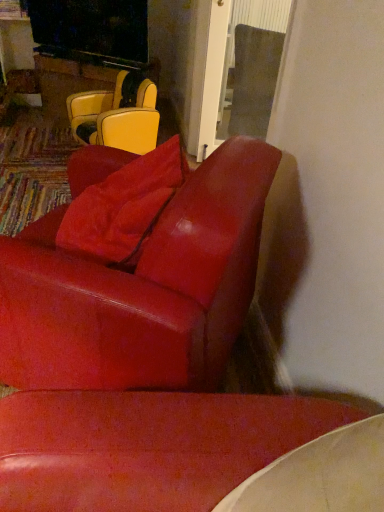
Question: Is glossy leather chair at center, which ranks as the second chair in back-to-front order, smaller than matte yellow leather chair at upper left, the first chair viewed from the back?

Choices:
 (A) yes
 (B) no

Answer: (B)

Question: Is glossy leather chair at center, the first chair positioned from the front, thinner than matte yellow leather chair at upper left, which is the 1th chair in top-to-bottom order?

Choices:
 (A) yes
 (B) no

Answer: (B)

Question: Is the position of glossy leather chair at center, which is counted as the 1th chair, starting from the bottom, less distant than that of matte yellow leather chair at upper left, the first chair viewed from the back?

Choices:
 (A) no
 (B) yes

Answer: (B)

Question: From the image's perspective, is glossy leather chair at center, the first chair positioned from the front, below matte yellow leather chair at upper left, which is the 1th chair in top-to-bottom order?

Choices:
 (A) yes
 (B) no

Answer: (A)

Question: Is matte yellow leather chair at upper left, which is the 1th chair in top-to-bottom order, surrounded by glossy leather chair at center, the second chair in the top-to-bottom sequence?

Choices:
 (A) no
 (B) yes

Answer: (A)

Question: Considering the positions of glossy leather chair at center, the second chair in the top-to-bottom sequence, and suede-like red pillow at upper center in the image, is glossy leather chair at center, the second chair in the top-to-bottom sequence, taller or shorter than suede-like red pillow at upper center?

Choices:
 (A) short
 (B) tall

Answer: (B)

Question: Looking at the image, does glossy leather chair at center, which is counted as the 1th chair, starting from the bottom, seem bigger or smaller compared to suede-like red pillow at upper center?

Choices:
 (A) big
 (B) small

Answer: (A)

Question: In the image, is glossy leather chair at center, which is counted as the 1th chair, starting from the bottom, on the left side or the right side of suede-like red pillow at upper center?

Choices:
 (A) left
 (B) right

Answer: (A)

Question: From a real-world perspective, is glossy leather chair at center, the first chair positioned from the front, positioned above or below suede-like red pillow at upper center?

Choices:
 (A) below
 (B) above

Answer: (A)

Question: Is matte yellow leather chair at upper left, which is the 1th chair in top-to-bottom order, spatially inside suede-like red pillow at upper center, or outside of it?

Choices:
 (A) outside
 (B) inside

Answer: (A)

Question: Would you say matte yellow leather chair at upper left, which is the 1th chair in top-to-bottom order, is to the left or to the right of suede-like red pillow at upper center in the picture?

Choices:
 (A) right
 (B) left

Answer: (B)

Question: Considering their positions, is matte yellow leather chair at upper left, the second chair from the bottom, located in front of or behind suede-like red pillow at upper center?

Choices:
 (A) behind
 (B) front

Answer: (A)

Question: Based on their sizes in the image, would you say matte yellow leather chair at upper left, the 2th chair from the front, is bigger or smaller than suede-like red pillow at upper center?

Choices:
 (A) big
 (B) small

Answer: (A)

Question: Does point (105, 248) appear closer or farther from the camera than point (41, 296)?

Choices:
 (A) closer
 (B) farther

Answer: (B)

Question: Visually, is suede-like red pillow at upper center positioned to the left or to the right of glossy leather chair at center, the second chair in the top-to-bottom sequence?

Choices:
 (A) right
 (B) left

Answer: (A)